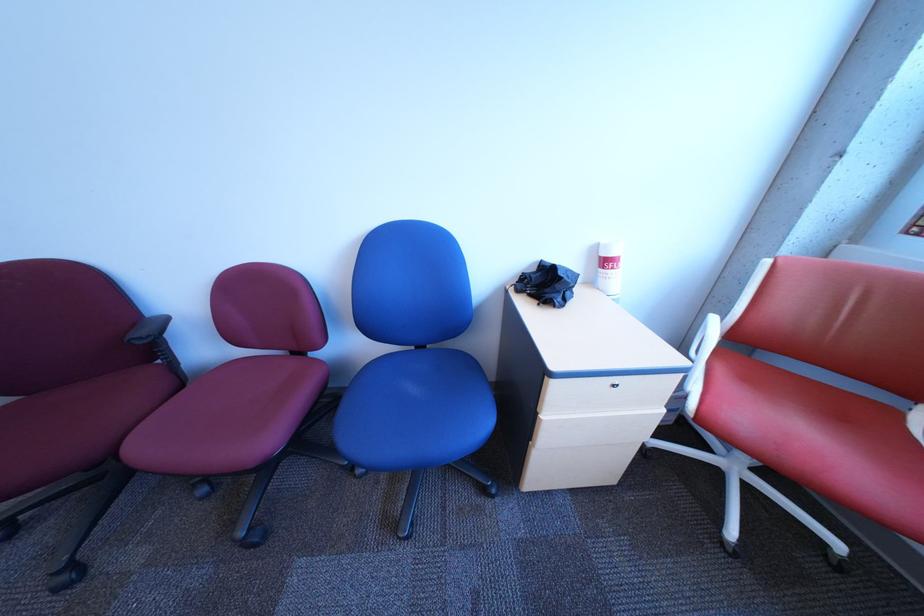
Where would you resting arm the white chair armrest? Please return your answer as a coordinate pair (x, y).

(703, 350)